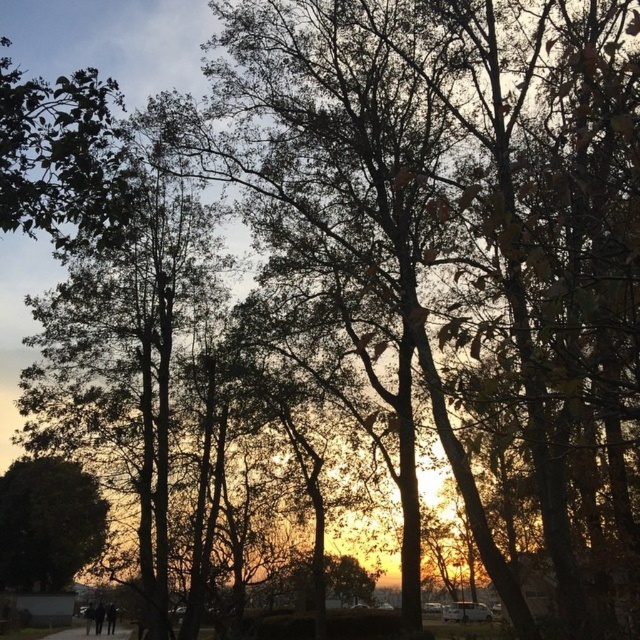
Question: Does green leafy tree at upper left appear over gravel path at lower center?

Choices:
 (A) no
 (B) yes

Answer: (B)

Question: Based on their relative distances, which object is farther from the gravel path at lower center?

Choices:
 (A) green leafy tree at upper left
 (B) green leafy tree at lower left

Answer: (A)

Question: Is green leafy tree at upper left smaller than gravel path at lower center?

Choices:
 (A) yes
 (B) no

Answer: (A)

Question: Is green leafy tree at lower left above gravel path at lower center?

Choices:
 (A) no
 (B) yes

Answer: (B)

Question: Which object is positioned farthest from the green leafy tree at lower left?

Choices:
 (A) green leafy tree at upper left
 (B) gravel path at lower center

Answer: (A)

Question: Which point is farther from the camera taking this photo?

Choices:
 (A) (65, 637)
 (B) (1, 84)
 (C) (13, 579)

Answer: (C)